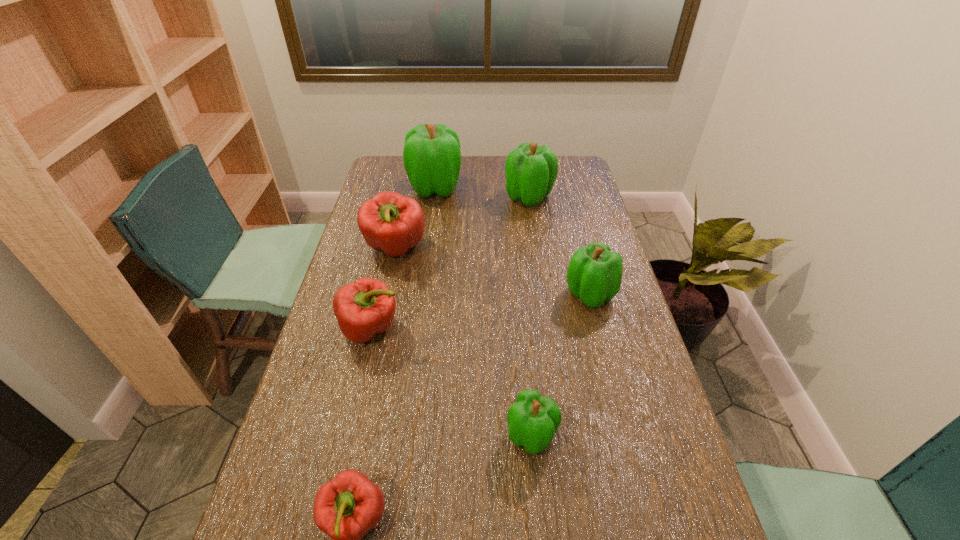
Identify the location of vacant space at the far left corner of the desktop. This screenshot has width=960, height=540. (400, 163).

Find the location of `empty space that is in between the second farthest pink bell pepper and the third farthest green bell pepper`. empty space that is in between the second farthest pink bell pepper and the third farthest green bell pepper is located at coordinates (481, 312).

Image resolution: width=960 pixels, height=540 pixels. I want to click on free area in between the nearest green bell pepper and the second smallest green bell pepper, so click(x=561, y=364).

Identify the location of vacant space in between the second smallest pink bell pepper and the second nearest bell pepper. This screenshot has height=540, width=960. (451, 382).

The width and height of the screenshot is (960, 540). Identify the location of unoccupied position between the third biggest green bell pepper and the tallest object. (513, 241).

At what (x,y) coordinates should I click in order to perform the action: click on vacant area that lies between the second biggest green bell pepper and the leftmost green bell pepper. Please return your answer as a coordinate pair (x, y). This screenshot has height=540, width=960. Looking at the image, I should click on (482, 192).

You are a GUI agent. You are given a task and a screenshot of the screen. Output one action in this format:
    pyautogui.click(x=<x>, y=<y>)
    Task: Click on the object that is the fifth closest to the second nearest pink bell pepper
    
    Given the screenshot: What is the action you would take?
    pyautogui.click(x=432, y=158)

Choose which object is the fifth nearest neighbor to the second farthest pink bell pepper. Please provide its 2D coordinates. Your answer should be formatted as a tuple, i.e. [(x, y)], where the tuple contains the x and y coordinates of a point satisfying the conditions above.

[(432, 158)]

In order to click on bell pepper that stands as the third closest to the third farthest green bell pepper in this screenshot , I will do `click(390, 222)`.

Image resolution: width=960 pixels, height=540 pixels. Find the location of `bell pepper that is the sixth closest to the third smallest green bell pepper`. bell pepper that is the sixth closest to the third smallest green bell pepper is located at coordinates (345, 508).